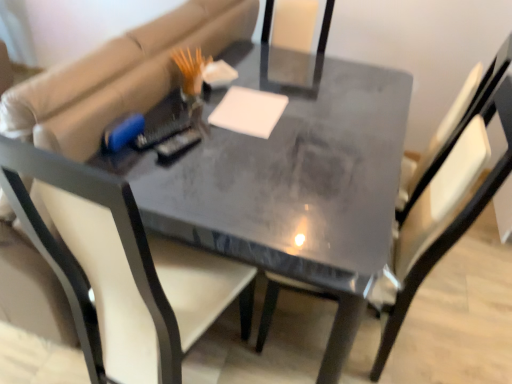
Question: Would you say matte gray table at center is to the left or to the right of white matte notepad at center in the picture?

Choices:
 (A) right
 (B) left

Answer: (A)

Question: Considering the positions of point (152, 170) and point (265, 99), is point (152, 170) closer or farther from the camera than point (265, 99)?

Choices:
 (A) farther
 (B) closer

Answer: (B)

Question: Based on their relative distances, which object is farther from the matte black chair at center, which appears as the second chair when viewed from the right?

Choices:
 (A) white matte notepad at center
 (B) matte gray table at center
 (C) matte gray chair at center, which is the first chair in right-to-left order

Answer: (C)

Question: Which object is the farthest from the white matte notepad at center?

Choices:
 (A) matte black chair at center, which appears as the second chair when viewed from the right
 (B) matte gray chair at center, which is the 2th chair from left to right
 (C) matte gray table at center

Answer: (A)